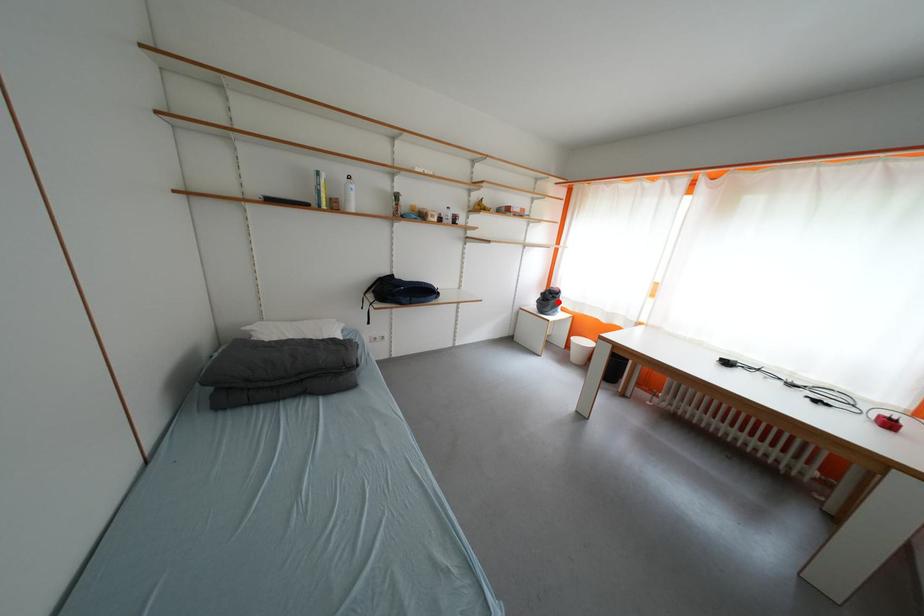
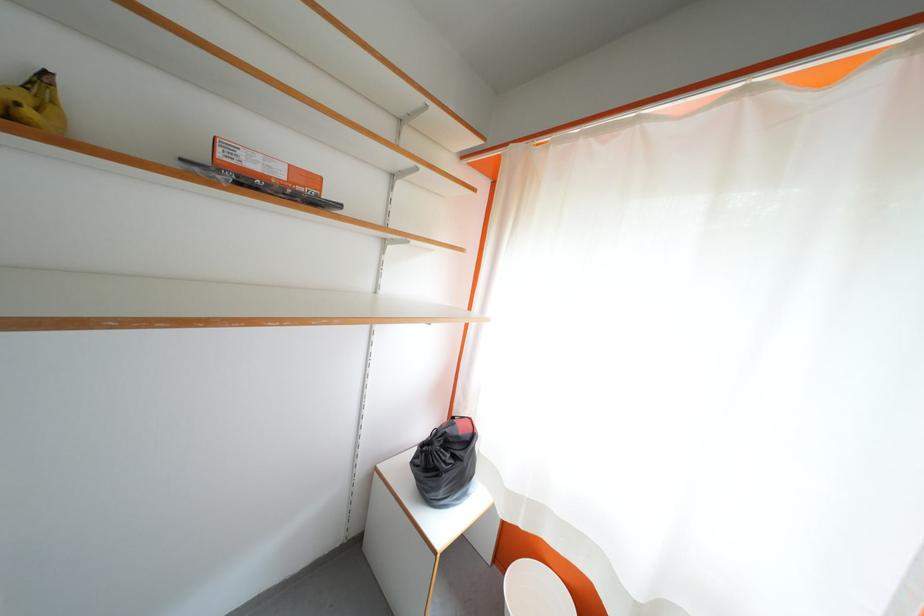
In the second image, find the point that corresponds to the highlighted location in the first image.

(455, 460)